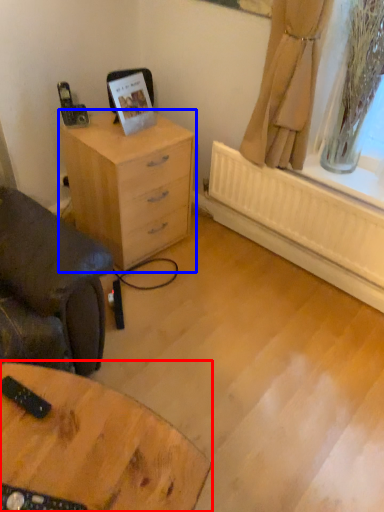
Question: Which point is further to the camera, table (highlighted by a red box) or chest of drawers (highlighted by a blue box)?

Choices:
 (A) table
 (B) chest of drawers

Answer: (B)